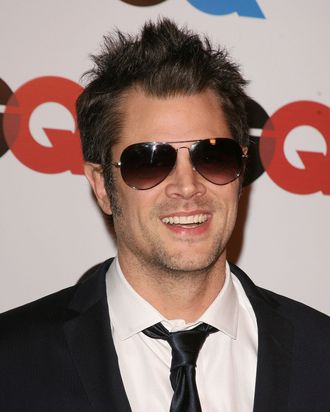
Where is `chair`? The height and width of the screenshot is (412, 330). chair is located at coordinates (168, 54).